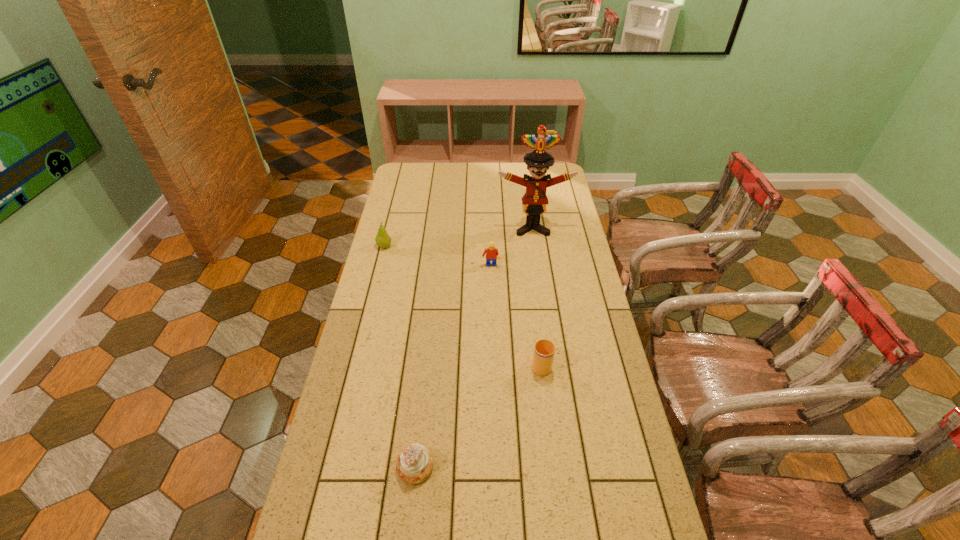
Where is `free spot at the far left corner of the desktop`? This screenshot has height=540, width=960. free spot at the far left corner of the desktop is located at coordinates (422, 175).

Identify the location of blank region between the farthest object and the cup. The width and height of the screenshot is (960, 540). click(537, 296).

At what (x,y) coordinates should I click in order to perform the action: click on empty space between the second farthest object and the pastry. Please return your answer as a coordinate pair (x, y). The width and height of the screenshot is (960, 540). Looking at the image, I should click on (400, 356).

This screenshot has width=960, height=540. I want to click on vacant region between the fourth farthest object and the tallest object, so click(537, 296).

Where is `empty location between the pastry and the farthest object`? Image resolution: width=960 pixels, height=540 pixels. empty location between the pastry and the farthest object is located at coordinates (474, 347).

Locate an element on the screen. free space between the cup and the leftmost object is located at coordinates (463, 305).

At what (x,y) coordinates should I click in order to perform the action: click on free space between the second nearest object and the pear. Please return your answer as a coordinate pair (x, y). The width and height of the screenshot is (960, 540). Looking at the image, I should click on (463, 305).

Locate an element on the screen. The image size is (960, 540). object that is the second closest to the cup is located at coordinates (491, 252).

Select which object is the closest to the cup. Please provide its 2D coordinates. Your answer should be formatted as a tuple, i.e. [(x, y)], where the tuple contains the x and y coordinates of a point satisfying the conditions above.

[(415, 463)]